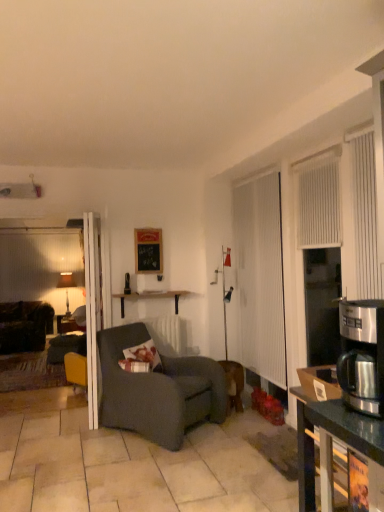
Question: Is white textured screen door at right next to black matte picture frame at center and touching it?

Choices:
 (A) yes
 (B) no

Answer: (B)

Question: Is white textured screen door at right looking in the opposite direction of black matte picture frame at center?

Choices:
 (A) no
 (B) yes

Answer: (A)

Question: From the image's perspective, is white textured screen door at right located beneath black matte picture frame at center?

Choices:
 (A) no
 (B) yes

Answer: (B)

Question: Is white textured screen door at right at the left side of black matte picture frame at center?

Choices:
 (A) no
 (B) yes

Answer: (A)

Question: Is white textured screen door at right taller than black matte picture frame at center?

Choices:
 (A) no
 (B) yes

Answer: (B)

Question: Is white textured screen door at right oriented towards black matte picture frame at center?

Choices:
 (A) yes
 (B) no

Answer: (A)

Question: Is dark gray fabric chair at center located within white glossy door at center?

Choices:
 (A) yes
 (B) no

Answer: (B)

Question: Is white glossy door at center thinner than dark gray fabric chair at center?

Choices:
 (A) no
 (B) yes

Answer: (B)

Question: Considering the relative sizes of white glossy door at center and dark gray fabric chair at center in the image provided, is white glossy door at center shorter than dark gray fabric chair at center?

Choices:
 (A) no
 (B) yes

Answer: (A)

Question: Can you confirm if white glossy door at center is bigger than dark gray fabric chair at center?

Choices:
 (A) yes
 (B) no

Answer: (B)

Question: From the image's perspective, does white glossy door at center appear higher than dark gray fabric chair at center?

Choices:
 (A) yes
 (B) no

Answer: (A)

Question: Does white glossy door at center appear on the right side of dark gray fabric chair at center?

Choices:
 (A) yes
 (B) no

Answer: (B)

Question: Is textured gray pillow at center placed right next to stainless steel coffee maker at right?

Choices:
 (A) yes
 (B) no

Answer: (B)